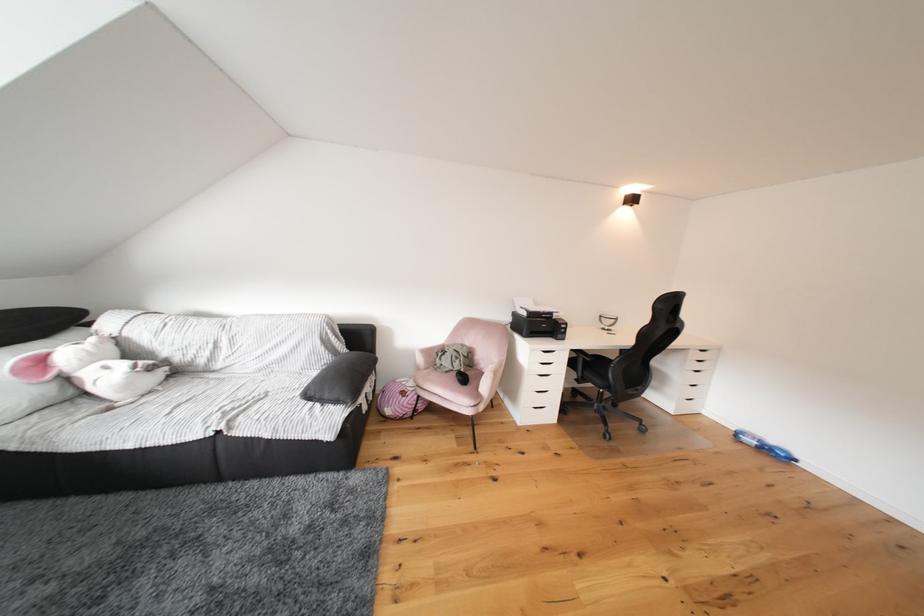
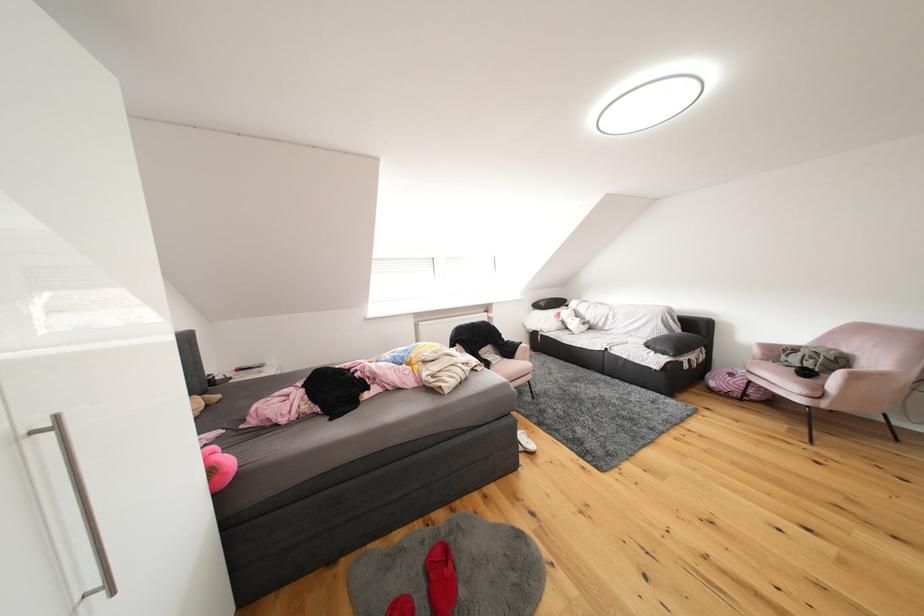
In the second image, find the point that corresponds to the point at 430,363 in the first image.

(766, 355)